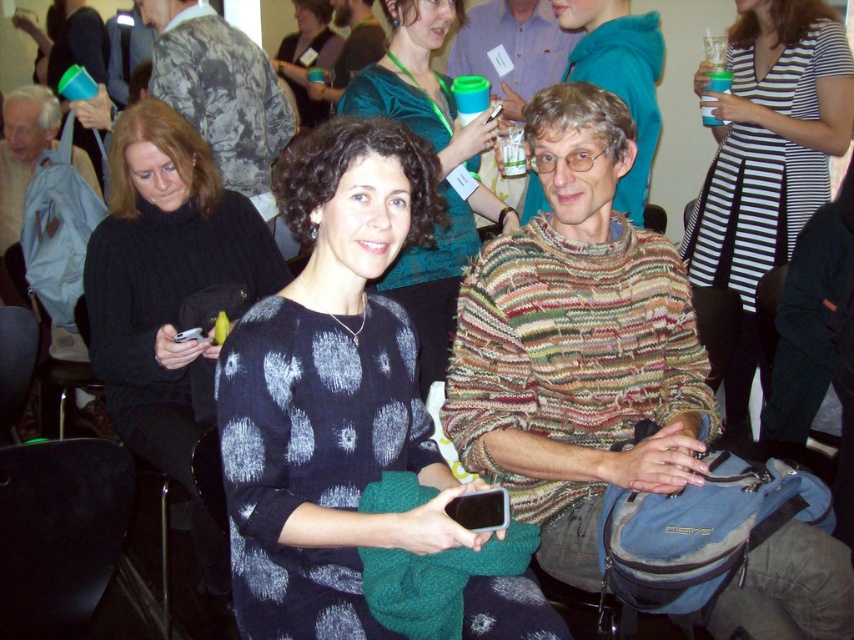
You are standing in the conference room and want to hand a document to the person wearing the dark blue printed dress at center and the matte black sweater at center. Which one can you reach first without moving from your spot?

The dark blue printed dress at center is closer to the viewer than the matte black sweater at center, so you can reach the person wearing the dark blue printed dress at center first without moving.

From the picture: You are organizing a charity event and need to decide which outfit to donate based on size. You see the black striped dress at upper center and the matte black sweater at center. Which one should you choose if you want to donate the larger item?

The black striped dress at upper center is bigger than the matte black sweater at center, so you should donate the black striped dress at upper center as it is the larger item.

You are organizing a photo shoot and need to arrange two models wearing the dark blue knit sweater at center and the matte black sweater at center. Based on their current positions in the image, which model should stand to the left of the other to maintain the original spatial relationship?

The dark blue knit sweater at center should stand to the right of the matte black sweater at center, as it was originally positioned on the right side of the matte black sweater at center in the image.